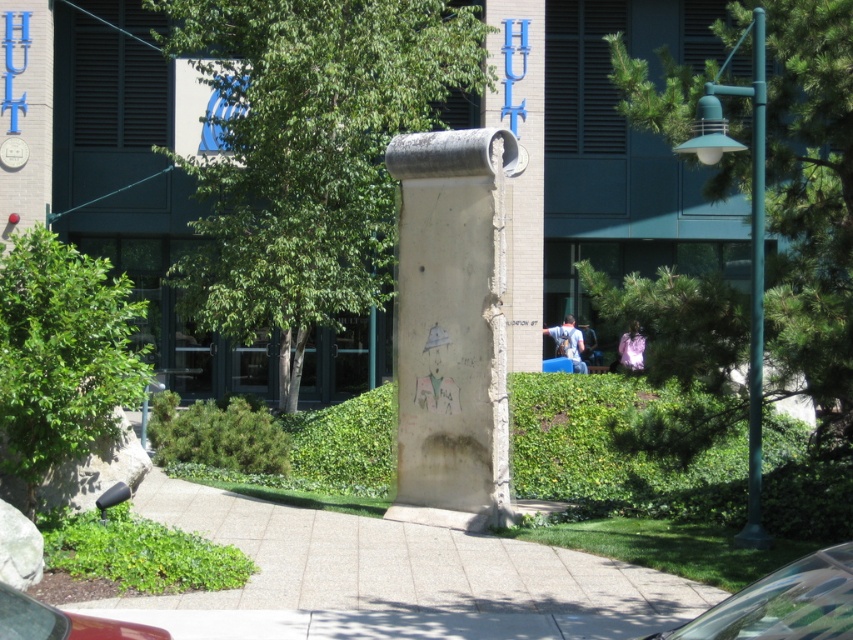
Question: Which point is farther to the camera?

Choices:
 (A) white concrete pillar at center
 (B) green leafy tree at center
 (C) green leafy tree at right
 (D) green leafy tree at left

Answer: (B)

Question: Is the position of green leafy tree at left more distant than that of metallic silver car at lower right?

Choices:
 (A) yes
 (B) no

Answer: (A)

Question: Does white concrete pillar at center appear under metallic silver car at lower right?

Choices:
 (A) yes
 (B) no

Answer: (B)

Question: Which of these objects is positioned farthest from the green leafy tree at left?

Choices:
 (A) white concrete pillar at center
 (B) metallic silver car at lower right
 (C) concrete at center

Answer: (B)

Question: Which object is the closest to the concrete at center?

Choices:
 (A) green leafy tree at center
 (B) green leafy tree at left

Answer: (B)

Question: Is green leafy tree at right to the right of white concrete pillar at center from the viewer's perspective?

Choices:
 (A) no
 (B) yes

Answer: (B)